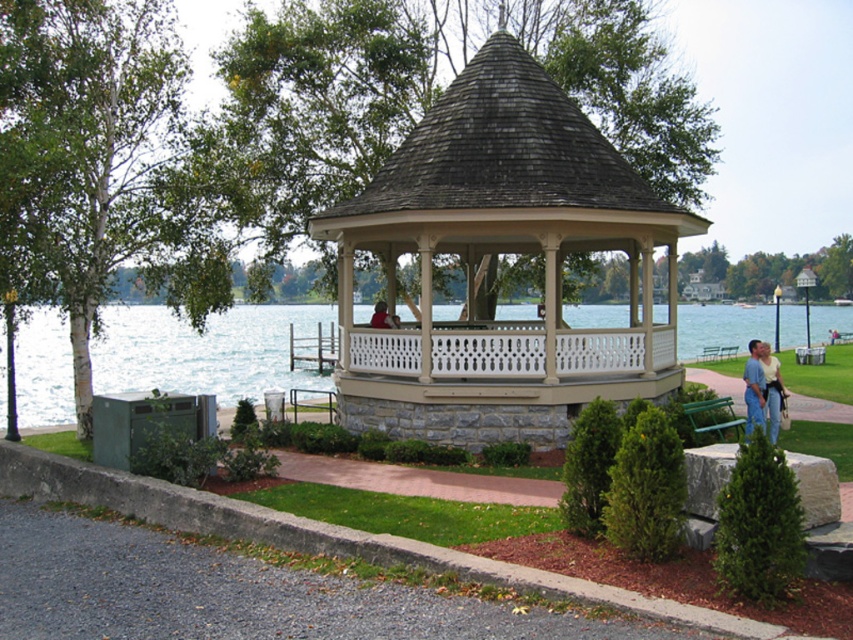
You are standing in the gazebo and see both the blue jeans at center and the red shirt at center. Which one is located to your right side?

The blue jeans at center is to the right of the red shirt at center, so the blue jeans at center is located to your right side.

You are standing in the gazebo and notice two items at the center. Which one is taller, the blue jeans at center or the red shirt at center?

The blue jeans at center is taller than the red shirt at center according to the description.